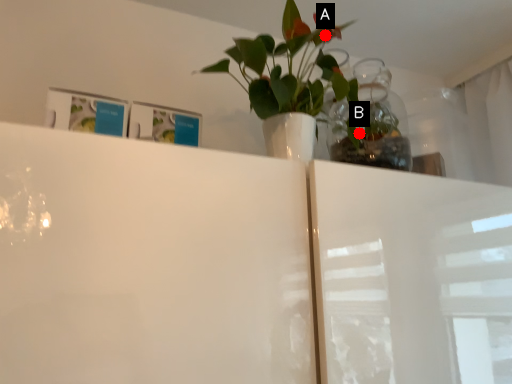
Question: Two points are circled on the image, labeled by A and B beside each circle. Which point is further to the camera?

Choices:
 (A) A is further
 (B) B is further

Answer: (B)